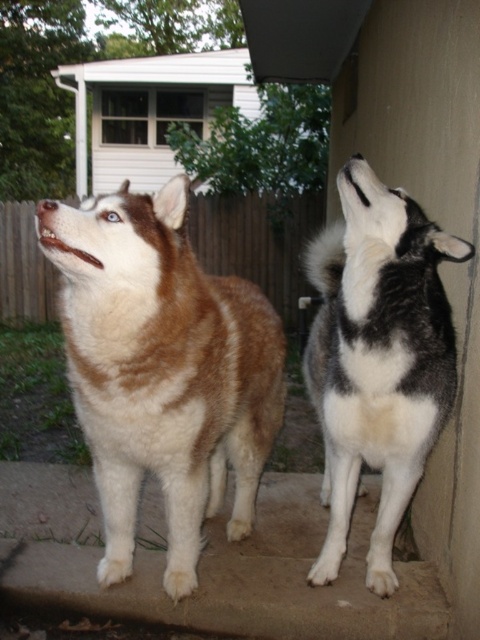
You are a photographer trying to capture both dogs in a single shot. Since you want to ensure both are in focus, you need to know their positions relative to you. Which dog is nearer to you, the brown fur dog at center or the black and white fur dog at upper right?

The brown fur dog at center is closer to the viewer than the black and white fur dog at upper right, so the brown fur dog at center is nearer to you.

You are standing in the backyard and want to place a small water bowl for the brown fur dog at center. Where should you place it relative to the wooden fence?

The brown fur dog at center is located at point (163, 369), so the water bowl should be placed near that position, which is closer to the center of the backyard away from the wooden fence.